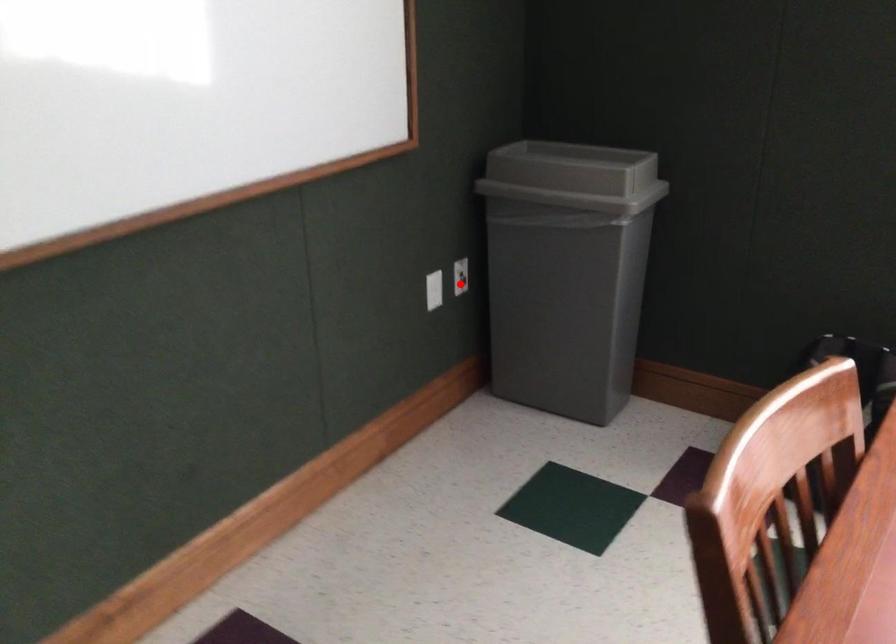
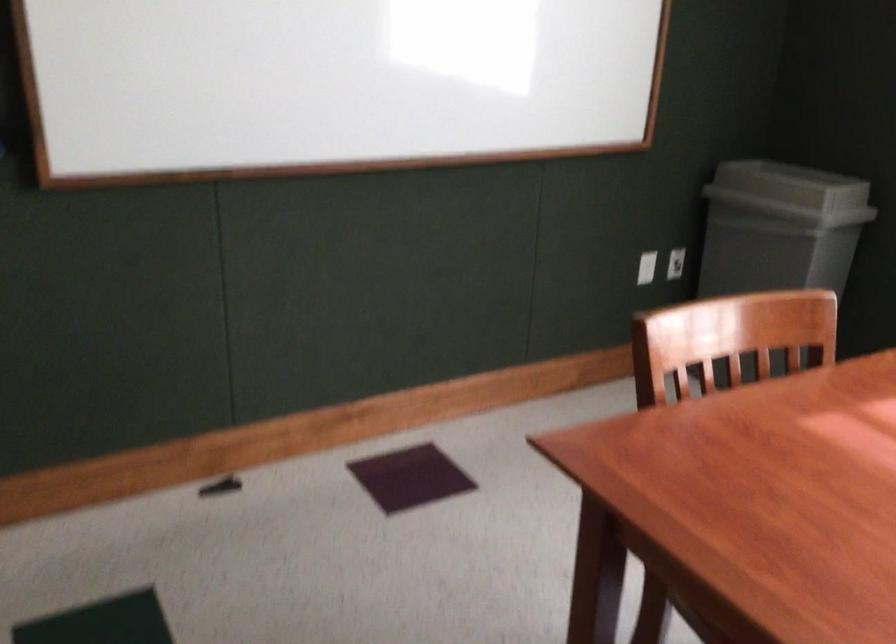
Where in the second image is the point corresponding to the highlighted location from the first image?

(675, 263)